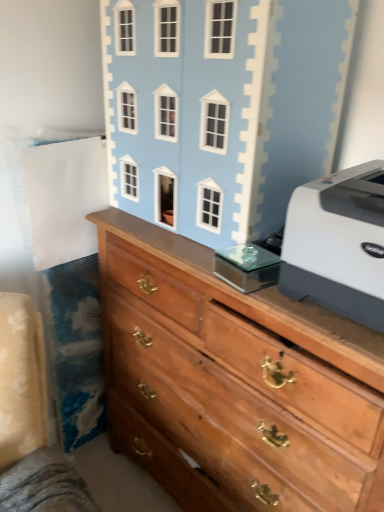
Question: From the image's perspective, is white plastic printer at right located above or below wooden chest of drawers at center?

Choices:
 (A) below
 (B) above

Answer: (B)

Question: Considering the positions of white plastic printer at right and wooden chest of drawers at center in the image, is white plastic printer at right taller or shorter than wooden chest of drawers at center?

Choices:
 (A) tall
 (B) short

Answer: (B)

Question: Estimate the real-world distances between objects in this image. Which object is closer to the light blue painted wood dollhouse at upper center?

Choices:
 (A) white plastic printer at right
 (B) wooden chest of drawers at center

Answer: (B)

Question: Which is nearer to the light blue painted wood dollhouse at upper center?

Choices:
 (A) wooden chest of drawers at center
 (B) white plastic printer at right

Answer: (A)